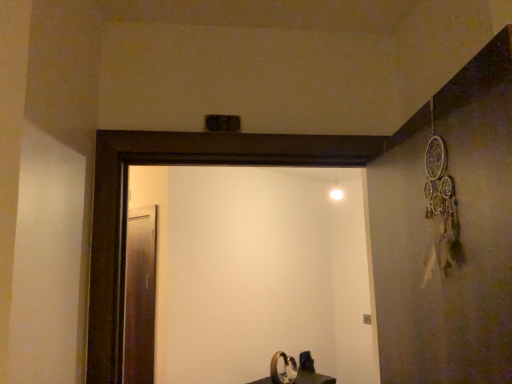
Question: Can you confirm if matte black sink at lower center is shorter than transparent glass screen door at left, which is counted as the second screen door, starting from the front?

Choices:
 (A) yes
 (B) no

Answer: (A)

Question: Is matte black sink at lower center closer to camera compared to transparent glass screen door at left, positioned as the first screen door in left-to-right order?

Choices:
 (A) yes
 (B) no

Answer: (A)

Question: From the image's perspective, does matte black sink at lower center appear lower than transparent glass screen door at left, positioned as the first screen door in left-to-right order?

Choices:
 (A) no
 (B) yes

Answer: (B)

Question: Considering the relative sizes of matte black sink at lower center and transparent glass screen door at left, which appears as the first screen door when viewed from the back, in the image provided, is matte black sink at lower center bigger than transparent glass screen door at left, which appears as the first screen door when viewed from the back,?

Choices:
 (A) yes
 (B) no

Answer: (A)

Question: Are matte black sink at lower center and transparent glass screen door at left, which appears as the first screen door when viewed from the back, making contact?

Choices:
 (A) no
 (B) yes

Answer: (A)

Question: Does point (x=370, y=329) appear closer or farther from the camera than point (x=265, y=377)?

Choices:
 (A) farther
 (B) closer

Answer: (A)

Question: From their relative heights in the image, would you say white glossy screen door at center, acting as the second screen door starting from the back, is taller or shorter than matte black sink at lower center?

Choices:
 (A) tall
 (B) short

Answer: (A)

Question: Relative to matte black sink at lower center, is white glossy screen door at center, which is the second screen door in left-to-right order, in front or behind?

Choices:
 (A) behind
 (B) front

Answer: (B)

Question: From a real-world perspective, relative to matte black sink at lower center, is white glossy screen door at center, positioned as the 1th screen door in front-to-back order, vertically above or below?

Choices:
 (A) above
 (B) below

Answer: (A)

Question: In terms of size, does transparent glass screen door at left, which is counted as the second screen door, starting from the front, appear bigger or smaller than matte black sink at lower center?

Choices:
 (A) small
 (B) big

Answer: (A)

Question: From a real-world perspective, relative to matte black sink at lower center, is transparent glass screen door at left, the second screen door in the right-to-left sequence, vertically above or below?

Choices:
 (A) below
 (B) above

Answer: (B)

Question: Considering the positions of transparent glass screen door at left, positioned as the first screen door in left-to-right order, and matte black sink at lower center in the image, is transparent glass screen door at left, positioned as the first screen door in left-to-right order, taller or shorter than matte black sink at lower center?

Choices:
 (A) short
 (B) tall

Answer: (B)

Question: Would you say transparent glass screen door at left, which appears as the first screen door when viewed from the back, is to the left or to the right of matte black sink at lower center in the picture?

Choices:
 (A) right
 (B) left

Answer: (B)

Question: In terms of size, does matte black sink at lower center appear bigger or smaller than white glossy screen door at center, acting as the second screen door starting from the back?

Choices:
 (A) small
 (B) big

Answer: (A)

Question: Do you think matte black sink at lower center is within white glossy screen door at center, which is the 1th screen door from right to left, or outside of it?

Choices:
 (A) outside
 (B) inside

Answer: (A)